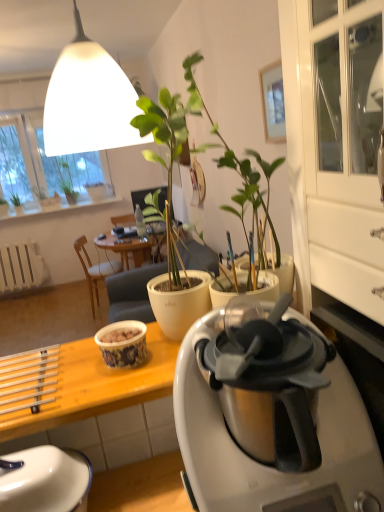
Question: From the image's perspective, is transparent plastic window screen at upper left on green matte plant at upper left, which is counted as the 2th houseplant, starting from the left?

Choices:
 (A) no
 (B) yes

Answer: (B)

Question: Considering the relative sizes of transparent plastic window screen at upper left and green matte plant at upper left, which is counted as the 2th houseplant, starting from the left, in the image provided, is transparent plastic window screen at upper left smaller than green matte plant at upper left, which is counted as the 2th houseplant, starting from the left,?

Choices:
 (A) yes
 (B) no

Answer: (B)

Question: Considering the relative sizes of transparent plastic window screen at upper left and green matte plant at upper left, the 2th houseplant from the right, in the image provided, is transparent plastic window screen at upper left shorter than green matte plant at upper left, the 2th houseplant from the right,?

Choices:
 (A) no
 (B) yes

Answer: (A)

Question: Considering the relative positions of transparent plastic window screen at upper left and green matte plant at upper left, which is counted as the 2th houseplant, starting from the left, in the image provided, is transparent plastic window screen at upper left in front of green matte plant at upper left, which is counted as the 2th houseplant, starting from the left,?

Choices:
 (A) yes
 (B) no

Answer: (A)

Question: Is transparent plastic window screen at upper left not close to green matte plant at upper left, the 2th houseplant from the right?

Choices:
 (A) yes
 (B) no

Answer: (B)

Question: Can you confirm if transparent plastic window screen at upper left is thinner than green matte plant at upper left, which is counted as the 2th houseplant, starting from the left?

Choices:
 (A) yes
 (B) no

Answer: (A)

Question: Are white matte lampshade at upper center and green matte plant at upper left, which is the third houseplant from right to left, beside each other?

Choices:
 (A) yes
 (B) no

Answer: (B)

Question: Does white matte lampshade at upper center appear on the left side of green matte plant at upper left, which is the third houseplant from right to left?

Choices:
 (A) no
 (B) yes

Answer: (A)

Question: Can you confirm if white matte lampshade at upper center is smaller than green matte plant at upper left, which is the third houseplant from right to left?

Choices:
 (A) no
 (B) yes

Answer: (A)

Question: Considering the relative sizes of white matte lampshade at upper center and green matte plant at upper left, the first houseplant when ordered from left to right, in the image provided, is white matte lampshade at upper center shorter than green matte plant at upper left, the first houseplant when ordered from left to right,?

Choices:
 (A) no
 (B) yes

Answer: (A)

Question: Is white matte lampshade at upper center further to camera compared to green matte plant at upper left, which is the third houseplant from right to left?

Choices:
 (A) no
 (B) yes

Answer: (A)

Question: Is white matte lampshade at upper center bigger than green matte plant at upper left, the first houseplant when ordered from left to right?

Choices:
 (A) no
 (B) yes

Answer: (B)

Question: Is white matte radiator at lower left completely or partially outside of green matte plant at upper left, the third houseplant from the left?

Choices:
 (A) no
 (B) yes

Answer: (B)